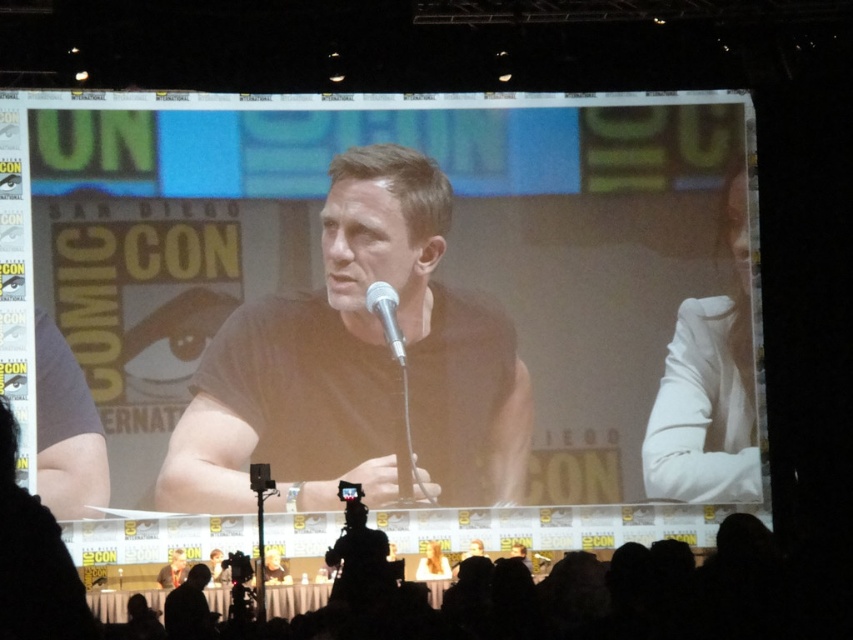
Is white fabric at right bigger than silver metallic microphone at center?

Yes.

The height and width of the screenshot is (640, 853). Describe the element at coordinates (709, 388) in the screenshot. I see `white fabric at right` at that location.

The height and width of the screenshot is (640, 853). What are the coordinates of `white fabric at right` in the screenshot? It's located at (709, 388).

Which is in front, point (462, 320) or point (381, 314)?

Point (381, 314)

At what (x,y) coordinates should I click in order to perform the action: click on matte black shirt at center. Please return your answer as a coordinate pair (x, y). Looking at the image, I should click on 397,291.

Who is higher up, silhouette crowd at lower center or white fabric at right?

white fabric at right is above.

Which is behind, point (816, 563) or point (740, 323)?

Point (740, 323)

Between point (123, 604) and point (733, 419), which one is positioned in front?

Point (123, 604)

Image resolution: width=853 pixels, height=640 pixels. Identify the location of silhouette crowd at lower center. (604, 595).